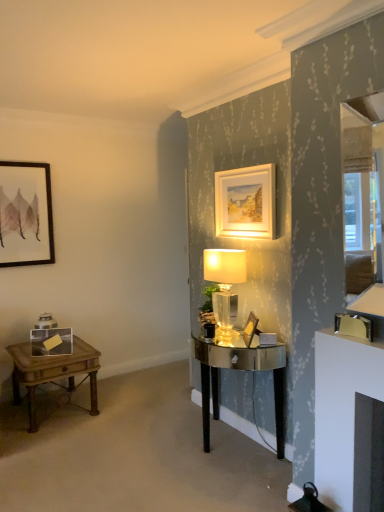
What is the approximate height of wooden picture frame at center, which is the 1th picture frame in front-to-back order?

wooden picture frame at center, which is the 1th picture frame in front-to-back order, is 6.74 inches in height.

Image resolution: width=384 pixels, height=512 pixels. Describe the element at coordinates (246, 202) in the screenshot. I see `matte gold picture frame at upper center, which is the 2th picture frame in back-to-front order` at that location.

In order to face matte black picture frame at upper left, arranged as the 3th picture frame when viewed from the right, should I rotate leftwards or rightwards?

You should look left and rotate roughly 21.358 degrees.

The height and width of the screenshot is (512, 384). What do you see at coordinates (52, 373) in the screenshot?
I see `wooden side table at left` at bounding box center [52, 373].

Find the location of `wooden side table at left`. wooden side table at left is located at coordinates (52, 373).

You are a GUI agent. You are given a task and a screenshot of the screen. Output one action in this format:
    pyautogui.click(x=<x>, y=<y>)
    Task: Click on the wooden picture frame at center, placed as the 1th picture frame when sorted from bottom to top
    The width and height of the screenshot is (384, 512).
    Given the screenshot: What is the action you would take?
    pyautogui.click(x=250, y=329)

Is matte gold picture frame at upper center, which is the second picture frame in left-to-right order, to the left of wooden side table at left from the viewer's perspective?

No, matte gold picture frame at upper center, which is the second picture frame in left-to-right order, is not to the left of wooden side table at left.

Find the location of `the 1st picture frame counting from the right side of the wooden side table at left`. the 1st picture frame counting from the right side of the wooden side table at left is located at coordinates (246, 202).

Is matte gold picture frame at upper center, the third picture frame when ordered from bottom to top, not within wooden side table at left?

That's correct, matte gold picture frame at upper center, the third picture frame when ordered from bottom to top, is outside of wooden side table at left.

Between matte gold picture frame at upper center, which is counted as the second picture frame, starting from the right, and wooden side table at left, which one has smaller size?

Smaller between the two is matte gold picture frame at upper center, which is counted as the second picture frame, starting from the right.

Does point (239, 215) lie in front of point (227, 337)?

No, (239, 215) is further to viewer.

Can you confirm if matte gold picture frame at upper center, which is counted as the second picture frame, starting from the right, is thinner than translucent glass lamp at center?

Correct, the width of matte gold picture frame at upper center, which is counted as the second picture frame, starting from the right, is less than that of translucent glass lamp at center.

From the image's perspective, is matte gold picture frame at upper center, which is the 2th picture frame in back-to-front order, located above or below translucent glass lamp at center?

matte gold picture frame at upper center, which is the 2th picture frame in back-to-front order, is situated higher than translucent glass lamp at center in the image.

Is matte gold picture frame at upper center, which is counted as the second picture frame, starting from the right, in contact with translucent glass lamp at center?

No, matte gold picture frame at upper center, which is counted as the second picture frame, starting from the right, is not making contact with translucent glass lamp at center.

From a real-world perspective, is wooden side table at left positioned above or below matte black picture frame at upper left, arranged as the 3th picture frame when viewed from the right?

From a real-world perspective, wooden side table at left is physically below matte black picture frame at upper left, arranged as the 3th picture frame when viewed from the right.

From the picture: Does wooden side table at left have a larger size compared to matte black picture frame at upper left, which ranks as the first picture frame in left-to-right order?

Correct, wooden side table at left is larger in size than matte black picture frame at upper left, which ranks as the first picture frame in left-to-right order.

Which of these two, wooden side table at left or matte black picture frame at upper left, the 3th picture frame viewed from the front, is thinner?

matte black picture frame at upper left, the 3th picture frame viewed from the front, is thinner.

From the image's perspective, which one is positioned higher, wooden side table at left or matte black picture frame at upper left, the 3th picture frame viewed from the front?

matte black picture frame at upper left, the 3th picture frame viewed from the front, is shown above in the image.

Considering the positions of point (246, 334) and point (245, 178), is point (246, 334) closer or farther from the camera than point (245, 178)?

Point (246, 334) is closer to the camera than point (245, 178).

Looking at this image, considering the sizes of objects wooden picture frame at center, which is the first picture frame from right to left, and matte gold picture frame at upper center, which is the 2th picture frame in back-to-front order, in the image provided, who is shorter, wooden picture frame at center, which is the first picture frame from right to left, or matte gold picture frame at upper center, which is the 2th picture frame in back-to-front order,?

wooden picture frame at center, which is the first picture frame from right to left, is shorter.

What's the angular difference between wooden picture frame at center, acting as the 3th picture frame starting from the left, and matte gold picture frame at upper center, which is the 2th picture frame in back-to-front order,'s facing directions?

The facing directions of wooden picture frame at center, acting as the 3th picture frame starting from the left, and matte gold picture frame at upper center, which is the 2th picture frame in back-to-front order, are 32.5 degrees apart.

Is there a large distance between wooden picture frame at center, which is the third picture frame from back to front, and matte gold picture frame at upper center, the third picture frame when ordered from bottom to top?

They are positioned close to each other.

What's the angular difference between translucent glass lamp at center and wooden picture frame at center, which appears as the third picture frame when viewed from the top,'s facing directions?

The angular difference between translucent glass lamp at center and wooden picture frame at center, which appears as the third picture frame when viewed from the top, is 29.3 degrees.

Considering the relative positions of translucent glass lamp at center and wooden picture frame at center, which appears as the third picture frame when viewed from the top, in the image provided, is translucent glass lamp at center to the left or to the right of wooden picture frame at center, which appears as the third picture frame when viewed from the top,?

translucent glass lamp at center is to the left of wooden picture frame at center, which appears as the third picture frame when viewed from the top.

From a real-world perspective, is translucent glass lamp at center above or below wooden picture frame at center, which is the first picture frame from right to left?

From a real-world perspective, translucent glass lamp at center is physically above wooden picture frame at center, which is the first picture frame from right to left.

Is wooden picture frame at center, placed as the 1th picture frame when sorted from bottom to top, completely or partially inside translucent glass lamp at center?

Yes, wooden picture frame at center, placed as the 1th picture frame when sorted from bottom to top, can be found within translucent glass lamp at center.

Considering the relative sizes of matte black picture frame at upper left, positioned as the second picture frame in top-to-bottom order, and wooden side table at left in the image provided, is matte black picture frame at upper left, positioned as the second picture frame in top-to-bottom order, shorter than wooden side table at left?

In fact, matte black picture frame at upper left, positioned as the second picture frame in top-to-bottom order, may be taller than wooden side table at left.

At what (x,y) coordinates should I click in order to perform the action: click on picture frame lying behind the wooden side table at left. Please return your answer as a coordinate pair (x, y). This screenshot has height=512, width=384. Looking at the image, I should click on [25, 214].

Is point (24, 234) positioned behind point (83, 354)?

Yes, it is behind point (83, 354).

Could you tell me if matte black picture frame at upper left, the 3th picture frame viewed from the front, is facing wooden side table at left?

No, matte black picture frame at upper left, the 3th picture frame viewed from the front, does not turn towards wooden side table at left.

Is shiny metallic desk at center touching wooden side table at left?

No, shiny metallic desk at center is not making contact with wooden side table at left.

Does shiny metallic desk at center have a lesser width compared to wooden side table at left?

Yes.

Between point (256, 339) and point (63, 357), which one is positioned behind?

The point (63, 357) is farther from the camera.

Measure the distance from shiny metallic desk at center to wooden side table at left.

shiny metallic desk at center and wooden side table at left are 1.14 meters apart.

Where is `table on the left of matte gold picture frame at upper center, which is counted as the second picture frame, starting from the right`? This screenshot has height=512, width=384. table on the left of matte gold picture frame at upper center, which is counted as the second picture frame, starting from the right is located at coordinates (52, 373).

Which picture frame is the 1st one when counting from the right side of the translucent glass lamp at center? Please provide its 2D coordinates.

[(246, 202)]

Which object lies nearer to the anchor point matte gold picture frame at upper center, which is counted as the second picture frame, starting from the right, translucent glass lamp at center or shiny metallic desk at center?

Among the two, translucent glass lamp at center is located nearer to matte gold picture frame at upper center, which is counted as the second picture frame, starting from the right.

From the image, which object appears to be nearer to matte gold picture frame at upper center, which is the second picture frame in left-to-right order, shiny metallic desk at center or translucent glass lamp at center?

translucent glass lamp at center lies closer to matte gold picture frame at upper center, which is the second picture frame in left-to-right order, than the other object.

Based on their spatial positions, is wooden picture frame at center, which is the first picture frame from right to left, or matte gold picture frame at upper center, which is the first picture frame in top-to-bottom order, further from matte black picture frame at upper left, the 3th picture frame viewed from the front?

wooden picture frame at center, which is the first picture frame from right to left, is further to matte black picture frame at upper left, the 3th picture frame viewed from the front.

Looking at the image, which one is located closer to wooden side table at left, translucent glass lamp at center or wooden picture frame at center, which appears as the third picture frame when viewed from the top?

translucent glass lamp at center is positioned closer to the anchor wooden side table at left.

Estimate the real-world distances between objects in this image. Which object is further from matte black picture frame at upper left, which is counted as the 2th picture frame, starting from the bottom, matte gold picture frame at upper center, which appears as the 2th picture frame when viewed from the front, or wooden picture frame at center, placed as the 1th picture frame when sorted from bottom to top?

Among the two, wooden picture frame at center, placed as the 1th picture frame when sorted from bottom to top, is located further to matte black picture frame at upper left, which is counted as the 2th picture frame, starting from the bottom.

Estimate the real-world distances between objects in this image. Which object is closer to wooden side table at left, shiny metallic desk at center or matte black picture frame at upper left, positioned as the second picture frame in top-to-bottom order?

matte black picture frame at upper left, positioned as the second picture frame in top-to-bottom order, is positioned closer to the anchor wooden side table at left.

From the image, which object appears to be nearer to shiny metallic desk at center, matte gold picture frame at upper center, which is counted as the second picture frame, starting from the right, or wooden picture frame at center, which is the 1th picture frame in front-to-back order?

wooden picture frame at center, which is the 1th picture frame in front-to-back order, lies closer to shiny metallic desk at center than the other object.

Which object lies nearer to the anchor point matte black picture frame at upper left, the 3th picture frame viewed from the front, wooden picture frame at center, which is the first picture frame from right to left, or shiny metallic desk at center?

shiny metallic desk at center is closer to matte black picture frame at upper left, the 3th picture frame viewed from the front.

The height and width of the screenshot is (512, 384). Identify the location of lamp that lies between matte gold picture frame at upper center, the third picture frame when ordered from bottom to top, and shiny metallic desk at center from top to bottom. (225, 286).

Where is `table between matte black picture frame at upper left, the 3th picture frame viewed from the front, and matte gold picture frame at upper center, which is the second picture frame in left-to-right order, in the horizontal direction`? This screenshot has height=512, width=384. table between matte black picture frame at upper left, the 3th picture frame viewed from the front, and matte gold picture frame at upper center, which is the second picture frame in left-to-right order, in the horizontal direction is located at coordinates (52, 373).

Identify the location of picture frame between translucent glass lamp at center and shiny metallic desk at center in the vertical direction. (x=250, y=329).

Identify the location of desk between wooden side table at left and matte gold picture frame at upper center, which is the 2th picture frame in back-to-front order, from left to right. Image resolution: width=384 pixels, height=512 pixels. (240, 370).